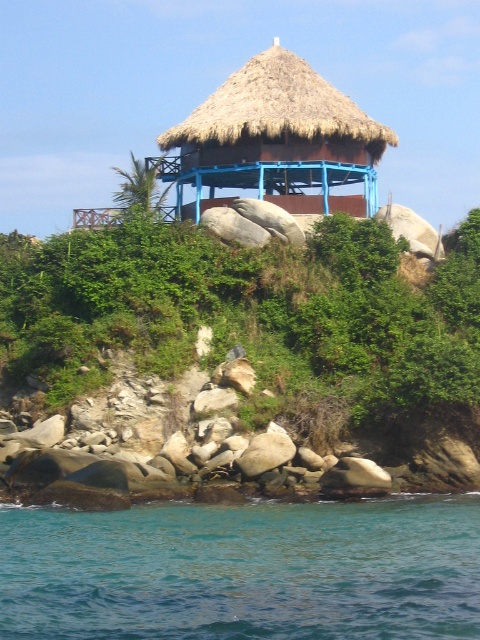
Which of these two, blue liquid water at lower center or thatched straw hut at center, stands shorter?

blue liquid water at lower center

Is point (54, 560) positioned before point (326, 109)?

Yes, it is.

Is point (476, 540) positioned behind point (208, 173)?

No.

Locate an element on the screen. blue liquid water at lower center is located at coordinates (243, 570).

Is green leafy shrubs at center positioned at the back of blue liquid water at lower center?

Yes.

Can you confirm if green leafy shrubs at center is positioned to the right of blue liquid water at lower center?

No, green leafy shrubs at center is not to the right of blue liquid water at lower center.

Is point (352, 376) in front of point (186, 547)?

No, it is behind (186, 547).

The image size is (480, 640). I want to click on green leafy shrubs at center, so click(x=252, y=314).

Is green leafy shrubs at center to the right of thatched straw hut at center from the viewer's perspective?

No, green leafy shrubs at center is not to the right of thatched straw hut at center.

Who is higher up, green leafy shrubs at center or thatched straw hut at center?

thatched straw hut at center is above.

Which is behind, point (388, 326) or point (167, 172)?

Point (167, 172)

Identify the location of green leafy shrubs at center. The image size is (480, 640). (252, 314).